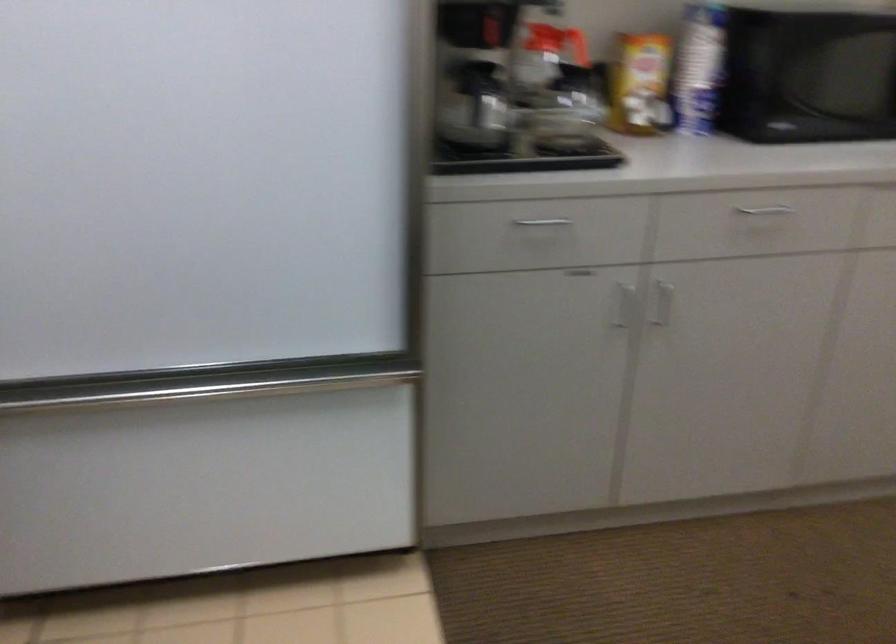
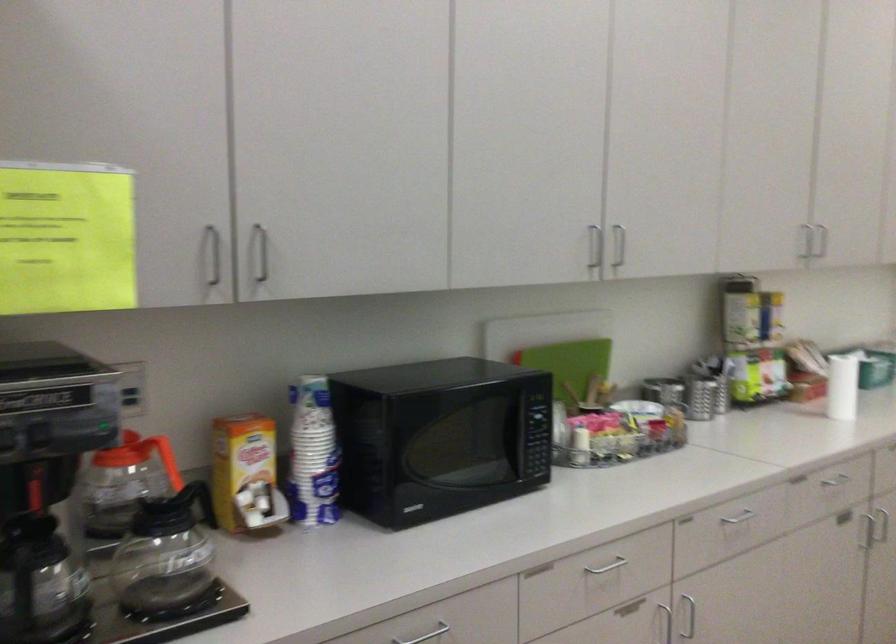
In the second image, find the point that corresponds to (564,154) in the first image.

(159, 619)